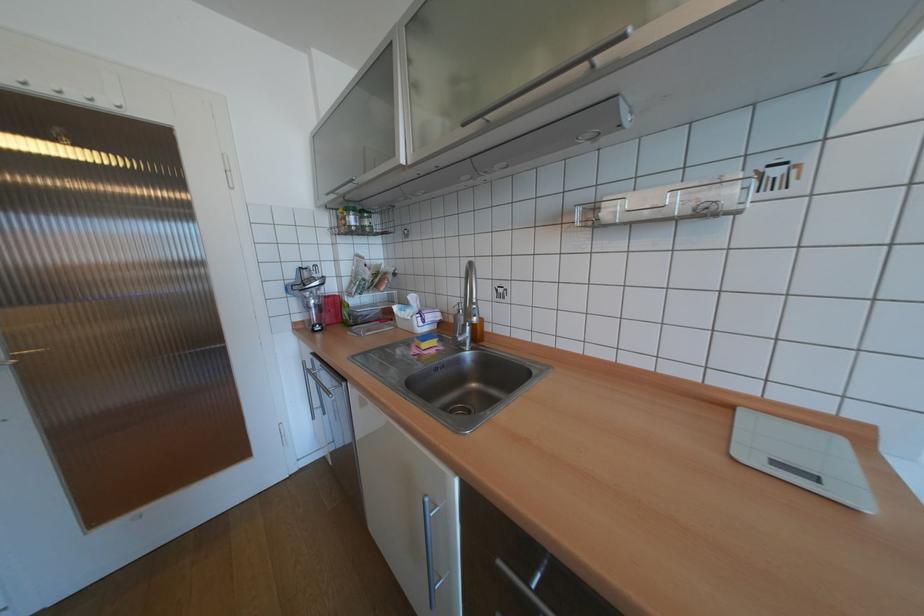
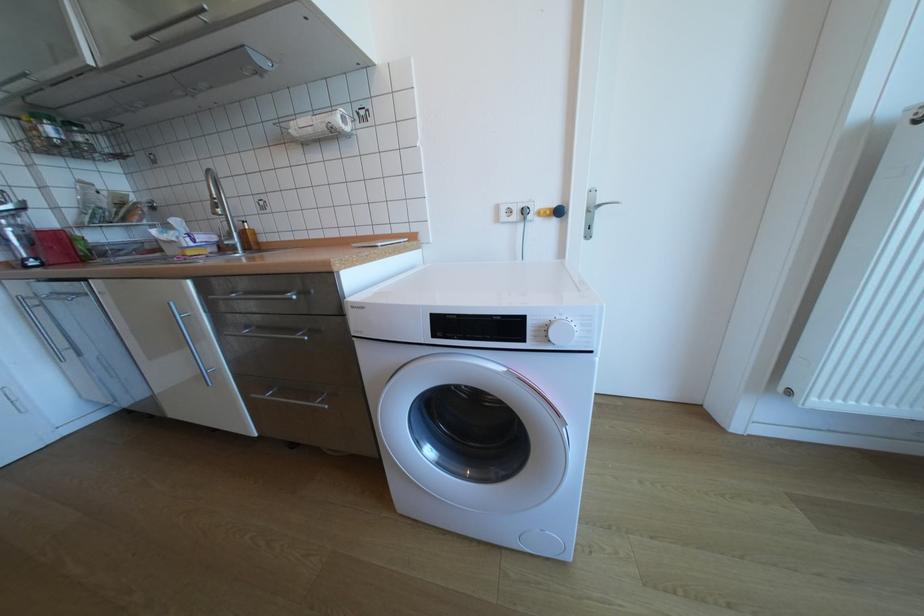
Locate, in the second image, the point that corresponds to point (701, 204) in the first image.

(334, 124)